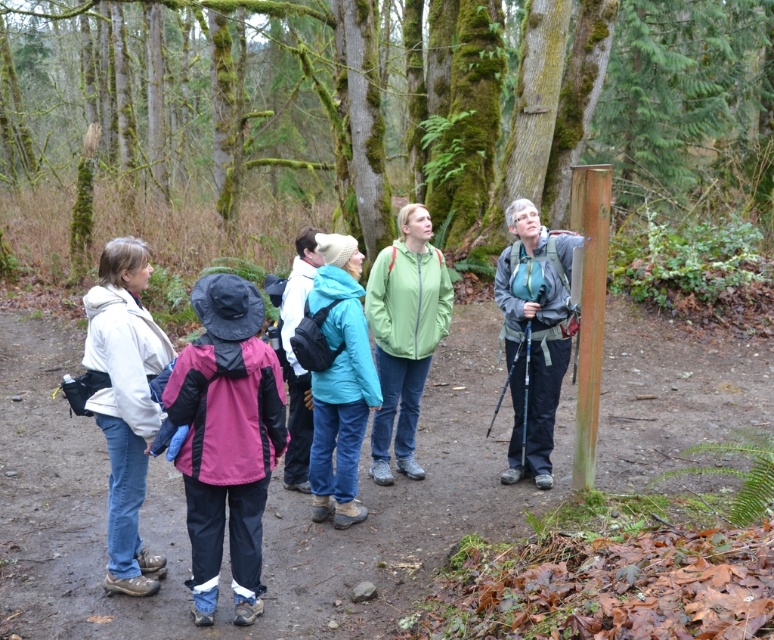
Is green matte jacket at center shorter than teal matte jacket at center?

No.

Is green matte jacket at center thinner than teal matte jacket at center?

In fact, green matte jacket at center might be wider than teal matte jacket at center.

This screenshot has height=640, width=774. Describe the element at coordinates (403, 333) in the screenshot. I see `green matte jacket at center` at that location.

Image resolution: width=774 pixels, height=640 pixels. In order to click on green matte jacket at center in this screenshot , I will do `click(403, 333)`.

Is point (721, 163) positioned in front of point (680, 438)?

No, it is behind (680, 438).

Is smooth wooden post at center above matte black backpack at center?

Yes.

Between point (387, 84) and point (43, 404), which one is positioned behind?

The point (387, 84) is more distant.

Find the location of `smooth wooden post at center`. smooth wooden post at center is located at coordinates (406, 97).

Does matte black backpack at center appear over teal matte jacket at center?

Indeed, matte black backpack at center is positioned over teal matte jacket at center.

Find the location of a particular element. This screenshot has height=640, width=774. matte black backpack at center is located at coordinates (265, 506).

Where is `matte black backpack at center`? matte black backpack at center is located at coordinates (265, 506).